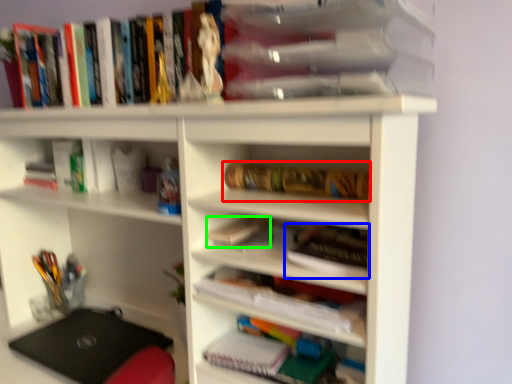
Question: Which is nearer to the book (highlighted by a red box)? book (highlighted by a blue box) or book (highlighted by a green box).

Choices:
 (A) book
 (B) book

Answer: (A)